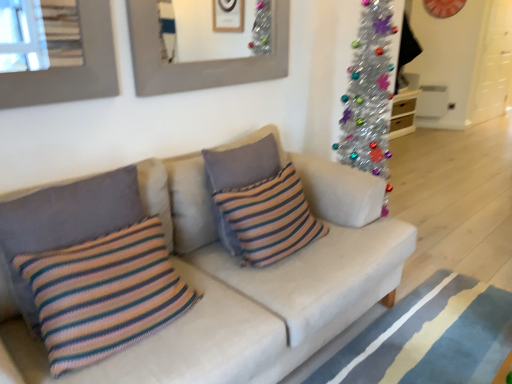
This screenshot has height=384, width=512. What do you see at coordinates (390, 331) in the screenshot? I see `blue striped rug at lower right` at bounding box center [390, 331].

What are the coordinates of `white fabric couch at center` in the screenshot? It's located at coord(250,281).

Describe the element at coordinates (244, 160) in the screenshot. I see `knitted striped pillow at center, marked as the first pillow in a back-to-front arrangement` at that location.

Image resolution: width=512 pixels, height=384 pixels. What are the coordinates of `matte gray picture frame at upper center` in the screenshot? It's located at (199, 62).

Is white fabric couch at center bigger than knitted multicolored pillow at left, positioned as the second pillow in front-to-back order?

Yes, white fabric couch at center is bigger than knitted multicolored pillow at left, positioned as the second pillow in front-to-back order.

Which point is more forward, (263, 334) or (42, 249)?

The point (42, 249) is more forward.

You are a GUI agent. You are given a task and a screenshot of the screen. Output one action in this format:
    pyautogui.click(x=<x>, y=<y>)
    Task: Click on the 2nd pillow behind the white fabric couch at center, counting from the anchor's position
    The height and width of the screenshot is (384, 512).
    Given the screenshot: What is the action you would take?
    pyautogui.click(x=78, y=218)

Is knitted multicolored pillow at left, positioned as the second pillow in front-to-back order, located within white fabric couch at center?

Absolutely, knitted multicolored pillow at left, positioned as the second pillow in front-to-back order, is inside white fabric couch at center.

Is blue striped rug at lower right a part of knitted striped pillow at center, the 1th pillow viewed from the front?

No, blue striped rug at lower right is not inside knitted striped pillow at center, the 1th pillow viewed from the front.

From the image's perspective, which is above, knitted striped pillow at center, the 1th pillow viewed from the front, or blue striped rug at lower right?

From the image's view, knitted striped pillow at center, the 1th pillow viewed from the front, is above.

Does point (93, 349) appear closer or farther from the camera than point (341, 380)?

Point (93, 349) is positioned closer to the camera compared to point (341, 380).

Can you tell me how much blue striped rug at lower right and knitted multicolored pillow at left, the 2th pillow when ordered from back to front, differ in facing direction?

The facing directions of blue striped rug at lower right and knitted multicolored pillow at left, the 2th pillow when ordered from back to front, are 90 degrees apart.

In order to click on pillow that is the 2nd object located above the blue striped rug at lower right (from the image's perspective) in this screenshot , I will do `click(78, 218)`.

From the picture: Could you tell me if blue striped rug at lower right is facing knitted multicolored pillow at left, the 2th pillow when ordered from back to front?

No, blue striped rug at lower right is not aimed at knitted multicolored pillow at left, the 2th pillow when ordered from back to front.

Which is behind, point (392, 330) or point (15, 295)?

The point (392, 330) is behind.

Who is bigger, white fabric couch at center or knitted striped pillow at center, arranged as the third pillow when viewed from the front?

white fabric couch at center.

Can you confirm if white fabric couch at center is wider than knitted striped pillow at center, arranged as the third pillow when viewed from the front?

Yes, white fabric couch at center is wider than knitted striped pillow at center, arranged as the third pillow when viewed from the front.

Is the depth of white fabric couch at center greater than that of knitted striped pillow at center, marked as the first pillow in a back-to-front arrangement?

No, white fabric couch at center is closer to the camera.

Is knitted striped pillow at center, arranged as the third pillow when viewed from the front, inside white fabric couch at center?

Yes, knitted striped pillow at center, arranged as the third pillow when viewed from the front, is inside white fabric couch at center.

Is white fabric couch at center positioned with its back to knitted striped pillow at center, the 1th pillow viewed from the front?

Yes.

In terms of width, does white fabric couch at center look wider or thinner when compared to knitted striped pillow at center, the 3th pillow from the back?

Clearly, white fabric couch at center has more width compared to knitted striped pillow at center, the 3th pillow from the back.

From the image's perspective, would you say white fabric couch at center is positioned over knitted striped pillow at center, the 1th pillow viewed from the front?

Yes, from the image's perspective, white fabric couch at center is above knitted striped pillow at center, the 1th pillow viewed from the front.

Which is less distant, (324, 264) or (126, 286)?

The point (126, 286) is closer.

From a real-world perspective, who is located lower, matte gray picture frame at upper center or knitted multicolored pillow at left, the 2th pillow when ordered from back to front?

knitted multicolored pillow at left, the 2th pillow when ordered from back to front, is physically lower.

Is matte gray picture frame at upper center positioned behind knitted multicolored pillow at left, the 2th pillow when ordered from back to front?

That is True.

Does matte gray picture frame at upper center have a greater height compared to knitted multicolored pillow at left, the 2th pillow when ordered from back to front?

Incorrect, the height of matte gray picture frame at upper center is not larger of that of knitted multicolored pillow at left, the 2th pillow when ordered from back to front.

Is knitted striped pillow at center, arranged as the third pillow when viewed from the front, wider than blue striped rug at lower right?

In fact, knitted striped pillow at center, arranged as the third pillow when viewed from the front, might be narrower than blue striped rug at lower right.

Could you tell me if knitted striped pillow at center, marked as the first pillow in a back-to-front arrangement, is facing blue striped rug at lower right?

No, knitted striped pillow at center, marked as the first pillow in a back-to-front arrangement, is not turned towards blue striped rug at lower right.

From the image's perspective, which object appears higher, knitted striped pillow at center, arranged as the third pillow when viewed from the front, or blue striped rug at lower right?

knitted striped pillow at center, arranged as the third pillow when viewed from the front, from the image's perspective.

Locate an element on the screen. pillow that is the 2nd object above the white fabric couch at center (from a real-world perspective) is located at coordinates (78, 218).

Where is `stripe located below the knitted striped pillow at center, the 3th pillow from the back (from the image's perspective)`? This screenshot has width=512, height=384. stripe located below the knitted striped pillow at center, the 3th pillow from the back (from the image's perspective) is located at coordinates (390, 331).

Based on their spatial positions, is knitted multicolored pillow at left, the 2th pillow when ordered from back to front, or knitted striped pillow at center, marked as the first pillow in a back-to-front arrangement, further from white fabric couch at center?

knitted multicolored pillow at left, the 2th pillow when ordered from back to front, is positioned further to the anchor white fabric couch at center.

When comparing their distances from white fabric couch at center, does matte gray picture frame at upper center or knitted multicolored pillow at left, positioned as the second pillow in front-to-back order, seem further?

matte gray picture frame at upper center is further to white fabric couch at center.

Which object lies nearer to the anchor point knitted striped pillow at center, arranged as the third pillow when viewed from the front, blue striped rug at lower right or matte gray picture frame at upper center?

The object closer to knitted striped pillow at center, arranged as the third pillow when viewed from the front, is matte gray picture frame at upper center.

Estimate the real-world distances between objects in this image. Which object is closer to matte gray picture frame at upper center, knitted striped pillow at center, arranged as the third pillow when viewed from the front, or knitted striped pillow at center, the 3th pillow from the back?

Among the two, knitted striped pillow at center, arranged as the third pillow when viewed from the front, is located nearer to matte gray picture frame at upper center.

Looking at the image, which one is located further to blue striped rug at lower right, matte gray picture frame at upper center or knitted striped pillow at center, arranged as the third pillow when viewed from the front?

matte gray picture frame at upper center lies further to blue striped rug at lower right than the other object.

Considering their positions, is knitted striped pillow at center, arranged as the third pillow when viewed from the front, positioned closer to knitted striped pillow at center, the 3th pillow from the back, than matte gray picture frame at upper center?

knitted striped pillow at center, arranged as the third pillow when viewed from the front, lies closer to knitted striped pillow at center, the 3th pillow from the back, than the other object.

From the image, which object appears to be nearer to knitted striped pillow at center, marked as the first pillow in a back-to-front arrangement, knitted striped pillow at center, the 3th pillow from the back, or blue striped rug at lower right?

Based on the image, knitted striped pillow at center, the 3th pillow from the back, appears to be nearer to knitted striped pillow at center, marked as the first pillow in a back-to-front arrangement.

Considering their positions, is matte gray picture frame at upper center positioned further to blue striped rug at lower right than knitted striped pillow at center, the 3th pillow from the back?

matte gray picture frame at upper center.

At what (x,y) coordinates should I click in order to perform the action: click on pillow between knitted multicolored pillow at left, positioned as the second pillow in front-to-back order, and white fabric couch at center from left to right. Please return your answer as a coordinate pair (x, y). Looking at the image, I should click on (104, 293).

Locate an element on the screen. pillow between matte gray picture frame at upper center and knitted multicolored pillow at left, positioned as the second pillow in front-to-back order, in the up-down direction is located at coordinates (244, 160).

The height and width of the screenshot is (384, 512). Identify the location of pillow between knitted striped pillow at center, the 1th pillow viewed from the front, and blue striped rug at lower right from left to right. (244, 160).

Image resolution: width=512 pixels, height=384 pixels. Identify the location of pillow situated between white fabric couch at center and blue striped rug at lower right from left to right. (244, 160).